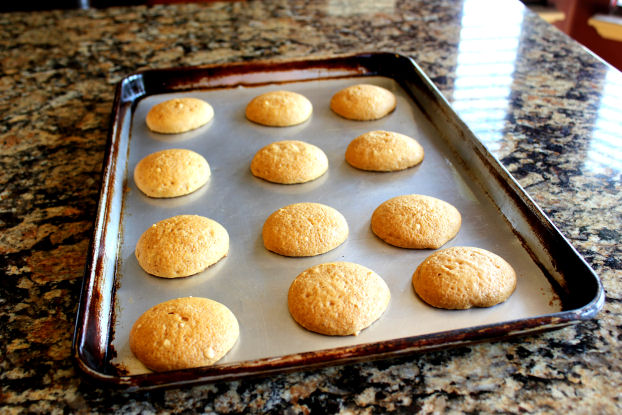
Find the location of a particular element. counter top is located at coordinates (12, 185).